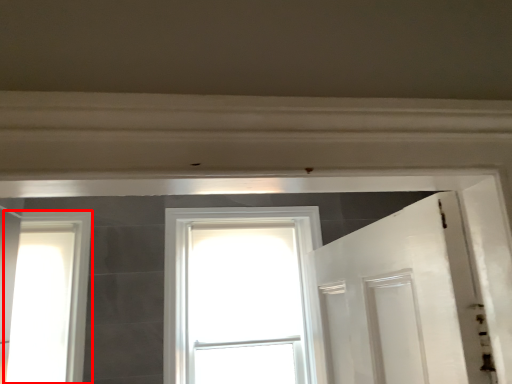
Question: From the image, what is the correct spatial relationship of window (annotated by the red box) in relation to window?

Choices:
 (A) left
 (B) right

Answer: (A)